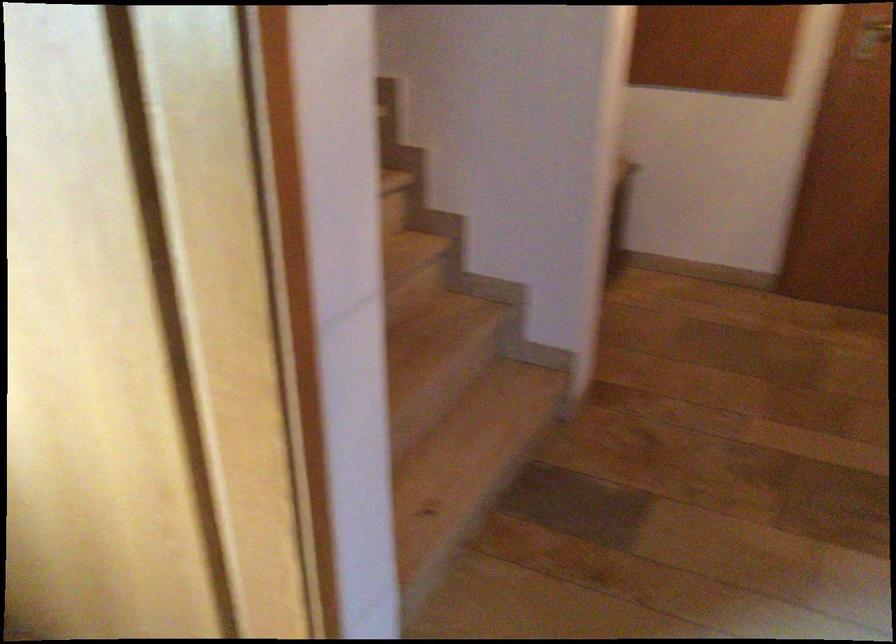
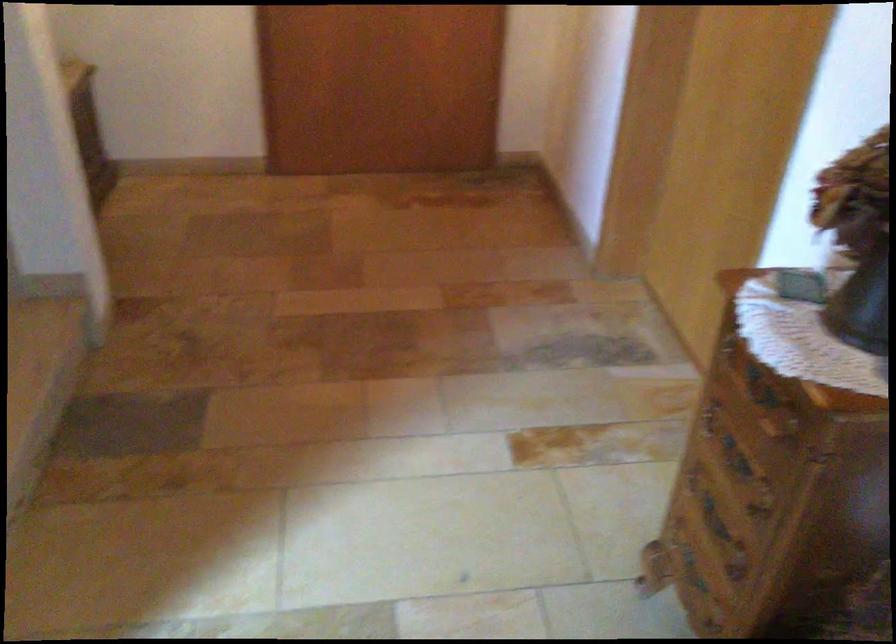
Question: The first image is from the beginning of the video and the second image is from the end. How did the camera likely rotate when shooting the video?

Choices:
 (A) Left
 (B) Right
 (C) Up
 (D) Down

Answer: (B)